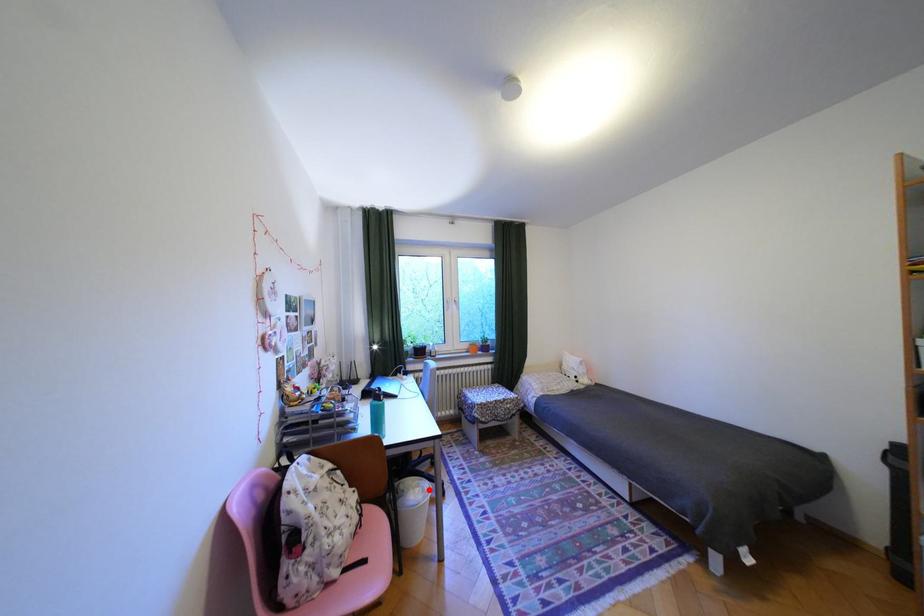
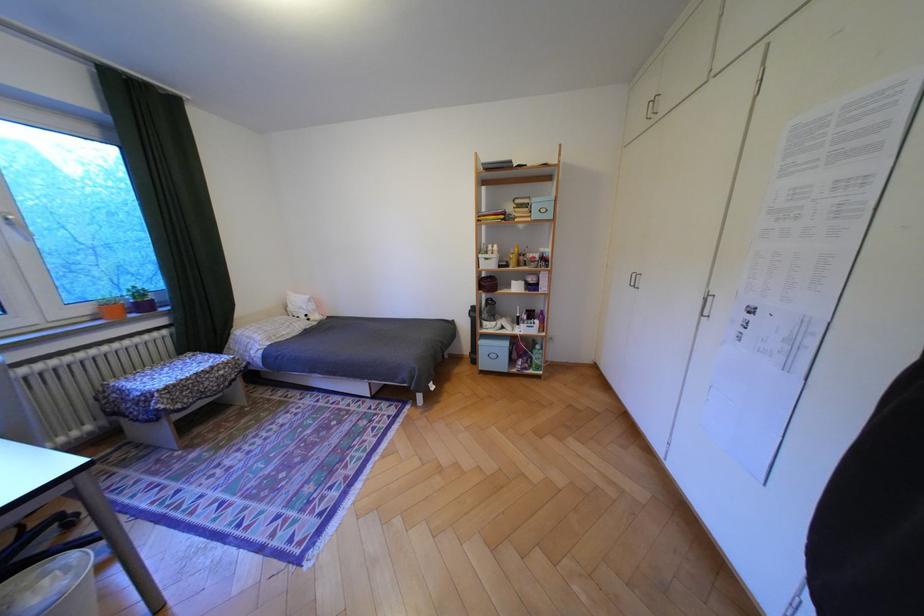
Question: I am providing you with two images of the same scene from different viewpoints. A red point is shown in image1. For the corresponding object point in image2, is it positioned nearer or farther from the camera?

Choices:
 (A) Nearer
 (B) Farther

Answer: (B)